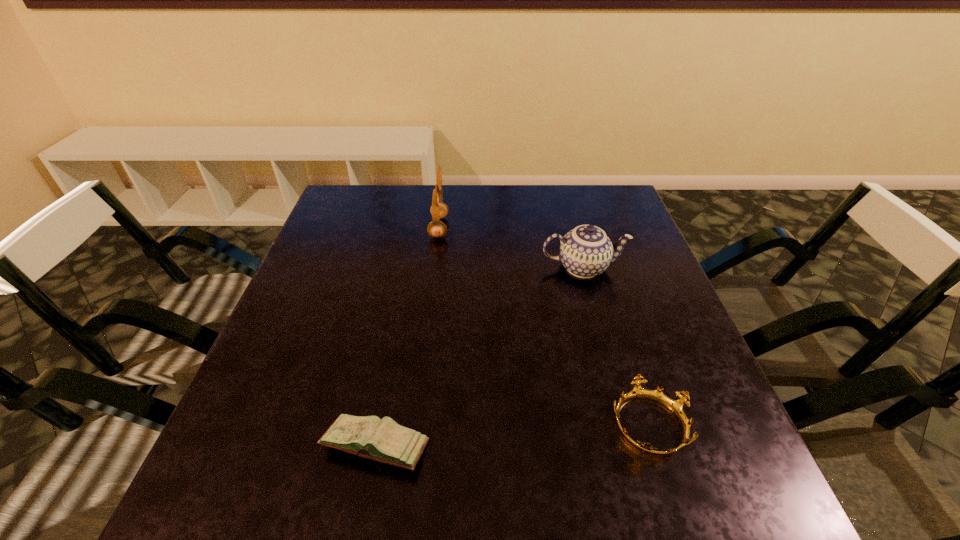
This screenshot has width=960, height=540. What are the coordinates of `the farthest object` in the screenshot? It's located at (436, 228).

This screenshot has height=540, width=960. I want to click on earphone, so click(x=436, y=228).

The image size is (960, 540). Find the location of `the third shortest object`. the third shortest object is located at coordinates (586, 251).

Where is `the second farthest object`? The height and width of the screenshot is (540, 960). the second farthest object is located at coordinates (586, 251).

At what (x,y) coordinates should I click in order to perform the action: click on crown. Please return your answer as a coordinate pair (x, y). The height and width of the screenshot is (540, 960). Looking at the image, I should click on (676, 407).

Image resolution: width=960 pixels, height=540 pixels. In order to click on diary in this screenshot , I will do `click(383, 440)`.

The image size is (960, 540). Identify the location of vacant space located 0.300m on the front-facing side of the tallest object. (554, 227).

Where is `free space located at the spout of the third shortest object`? The width and height of the screenshot is (960, 540). free space located at the spout of the third shortest object is located at coordinates (657, 267).

Identify the location of free spot located on the left of the crown. (452, 424).

Locate an element on the screen. This screenshot has height=540, width=960. vacant space located 0.320m on the right of the diary is located at coordinates tap(615, 446).